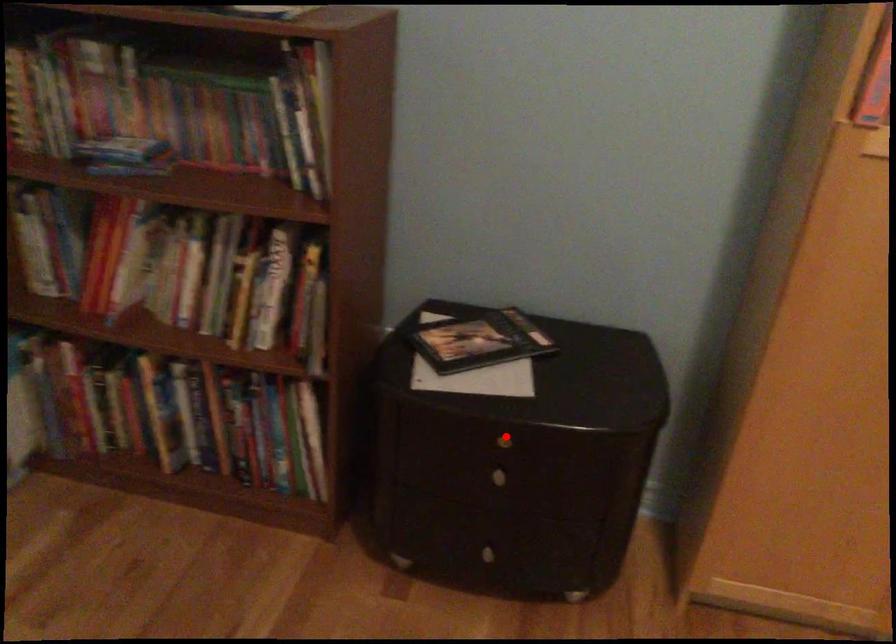
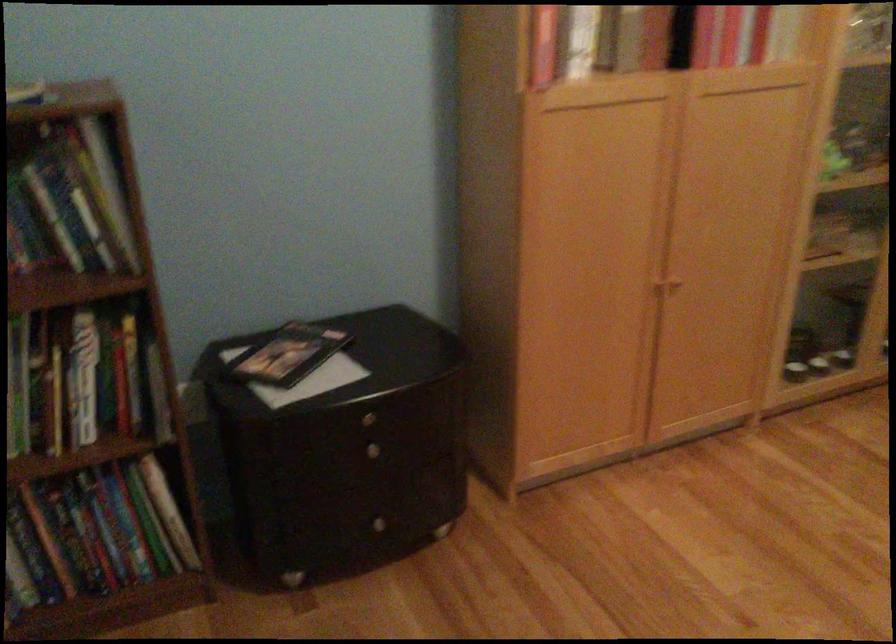
Question: I am providing you with two images of the same scene from different viewpoints. Given a red point in image1, look at the same physical point in image2. Is it:

Choices:
 (A) Closer to the viewpoint
 (B) Farther from the viewpoint

Answer: (B)